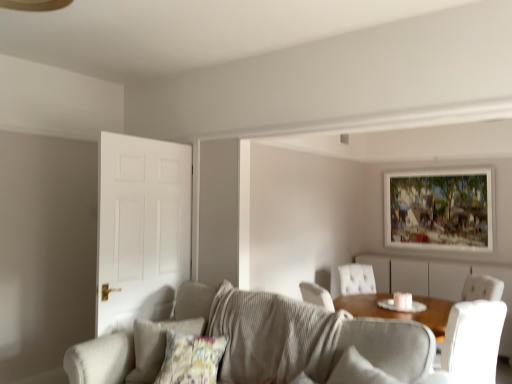
Question: In terms of height, does wooden-framed painting at upper right look taller or shorter compared to white leather chair at right?

Choices:
 (A) tall
 (B) short

Answer: (A)

Question: Is wooden-framed painting at upper right wider or thinner than white leather chair at right?

Choices:
 (A) thin
 (B) wide

Answer: (A)

Question: Which object is positioned closest to the wooden dresser at center?

Choices:
 (A) white matte door at left
 (B) textured gray couch at center
 (C) floral fabric pillow at lower left
 (D) wooden-framed painting at upper right
 (E) white leather chair at right

Answer: (D)

Question: Which is farther from the wooden-framed painting at upper right?

Choices:
 (A) wooden dresser at center
 (B) floral fabric pillow at lower left
 (C) white leather chair at right
 (D) textured gray couch at center
 (E) white matte door at left

Answer: (B)